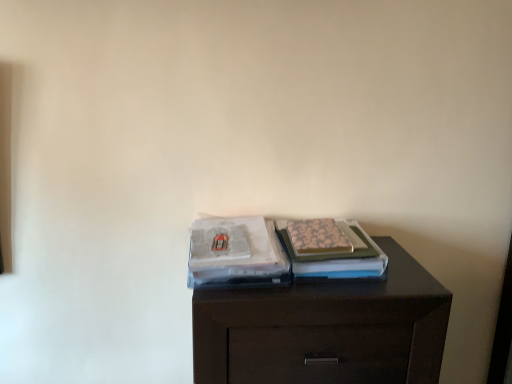
Question: Is patterned paper magazine at center, which ranks as the 2th magazine in left-to-right order, taller than matte plastic magazine at center, which is the first magazine from left to right?

Choices:
 (A) yes
 (B) no

Answer: (A)

Question: Is patterned paper magazine at center, which ranks as the 2th magazine in left-to-right order, smaller than matte plastic magazine at center, the 2th magazine from the right?

Choices:
 (A) yes
 (B) no

Answer: (B)

Question: Does patterned paper magazine at center, which ranks as the 2th magazine in left-to-right order, have a lesser width compared to matte plastic magazine at center, which is the first magazine from left to right?

Choices:
 (A) no
 (B) yes

Answer: (B)

Question: Is patterned paper magazine at center, which ranks as the first magazine in right-to-left order, bigger than matte plastic magazine at center, which is the first magazine from left to right?

Choices:
 (A) yes
 (B) no

Answer: (A)

Question: From the image's perspective, would you say patterned paper magazine at center, which ranks as the 2th magazine in left-to-right order, is positioned over matte plastic magazine at center, the 2th magazine from the right?

Choices:
 (A) yes
 (B) no

Answer: (A)

Question: From a real-world perspective, relative to patterned paper magazine at center, which ranks as the first magazine in right-to-left order, is dark wood chest of drawers at center vertically above or below?

Choices:
 (A) above
 (B) below

Answer: (B)

Question: Is point (283, 329) positioned closer to the camera than point (286, 243)?

Choices:
 (A) closer
 (B) farther

Answer: (A)

Question: In the image, is dark wood chest of drawers at center on the left side or the right side of patterned paper magazine at center, which ranks as the first magazine in right-to-left order?

Choices:
 (A) right
 (B) left

Answer: (B)

Question: From their relative heights in the image, would you say dark wood chest of drawers at center is taller or shorter than patterned paper magazine at center, which ranks as the 2th magazine in left-to-right order?

Choices:
 (A) short
 (B) tall

Answer: (B)

Question: Looking at the image, does matte plastic magazine at center, which is the first magazine from left to right, seem bigger or smaller compared to dark wood chest of drawers at center?

Choices:
 (A) small
 (B) big

Answer: (A)

Question: In the image, is matte plastic magazine at center, which is the first magazine from left to right, positioned in front of or behind dark wood chest of drawers at center?

Choices:
 (A) behind
 (B) front

Answer: (A)

Question: Considering the positions of matte plastic magazine at center, the 2th magazine from the right, and dark wood chest of drawers at center in the image, is matte plastic magazine at center, the 2th magazine from the right, wider or thinner than dark wood chest of drawers at center?

Choices:
 (A) thin
 (B) wide

Answer: (A)

Question: From a real-world perspective, is matte plastic magazine at center, the 2th magazine from the right, physically located above or below dark wood chest of drawers at center?

Choices:
 (A) below
 (B) above

Answer: (B)

Question: Would you say dark wood chest of drawers at center is to the left or to the right of matte plastic magazine at center, the 2th magazine from the right, in the picture?

Choices:
 (A) left
 (B) right

Answer: (B)

Question: From the image's perspective, is dark wood chest of drawers at center positioned above or below matte plastic magazine at center, the 2th magazine from the right?

Choices:
 (A) below
 (B) above

Answer: (A)